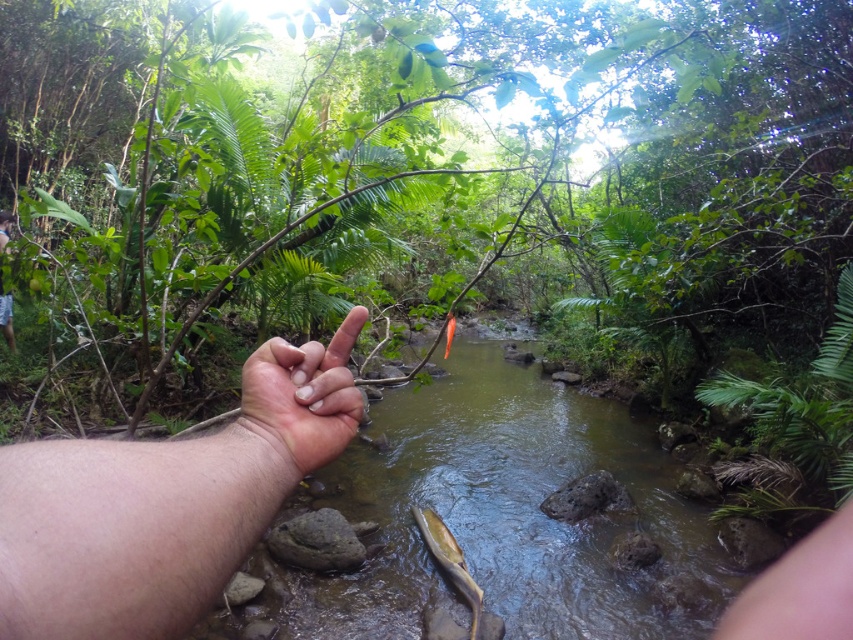
Question: From the image, what is the correct spatial relationship of shiny golden fish at center in relation to orange matte fish at center?

Choices:
 (A) above
 (B) below

Answer: (B)

Question: Does skinny flesh at center lie in front of orange matte fish at center?

Choices:
 (A) yes
 (B) no

Answer: (A)

Question: Which of these objects is positioned farthest from the shiny golden fish at center?

Choices:
 (A) skinny flesh at center
 (B) orange matte fish at center

Answer: (A)

Question: Which of the following is the closest to the observer?

Choices:
 (A) smooth skin hand at center
 (B) skinny flesh at center
 (C) clear water at stream center

Answer: (B)

Question: Is clear water at stream center further to the viewer compared to shiny golden fish at center?

Choices:
 (A) yes
 (B) no

Answer: (A)

Question: Which of the following is the closest to the observer?

Choices:
 (A) pale skin at center
 (B) shiny golden fish at center

Answer: (A)